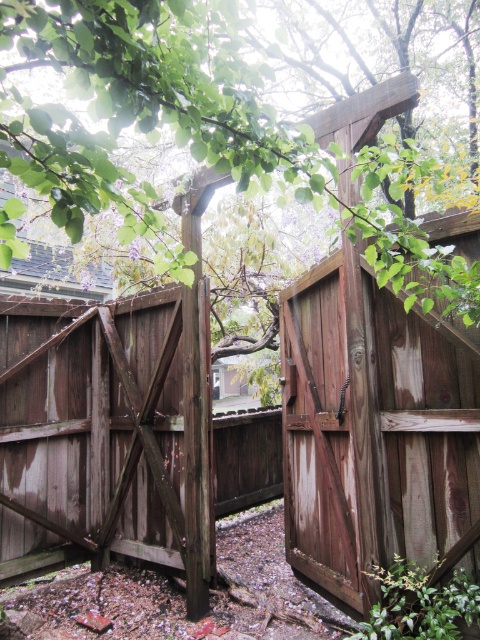
Which is more to the right, green wood tree at upper center or weathered brown wooden gate at center?

Positioned to the right is green wood tree at upper center.

Who is shorter, green wood tree at upper center or weathered brown wooden gate at center?

With less height is green wood tree at upper center.

Which is in front, point (80, 156) or point (133, 358)?

Positioned in front is point (80, 156).

Where is `green wood tree at upper center`? The image size is (480, 640). green wood tree at upper center is located at coordinates (192, 129).